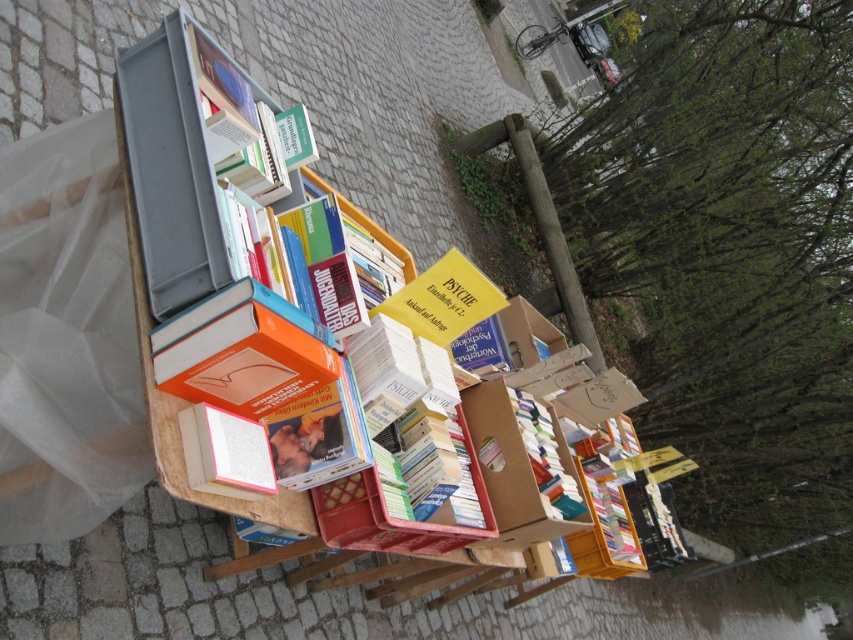
Who is shorter, orange matte book at center or wooden bookshelf at center?

orange matte book at center is shorter.

Can you confirm if orange matte book at center is positioned above wooden bookshelf at center?

Yes, orange matte book at center is above wooden bookshelf at center.

The height and width of the screenshot is (640, 853). Describe the element at coordinates (242, 349) in the screenshot. I see `orange matte book at center` at that location.

Locate an element on the screen. orange matte book at center is located at coordinates pyautogui.click(x=242, y=349).